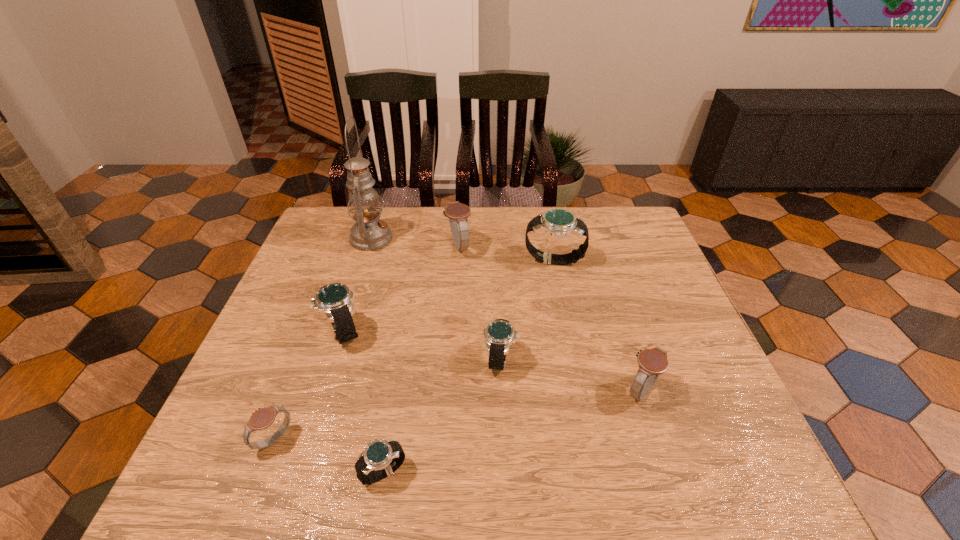
This screenshot has height=540, width=960. Identify the location of free spot at the left edge of the desktop. click(252, 433).

Identify the location of vacant space at the right edge. Image resolution: width=960 pixels, height=540 pixels. (604, 252).

The width and height of the screenshot is (960, 540). In order to click on free region at the far left corner of the desktop in this screenshot , I will do `click(336, 218)`.

In the image, there is a desktop. What are the coordinates of `vacant area at the near right corner` in the screenshot? It's located at (731, 480).

Identify the location of vacant space in between the rightmost gray watch and the fourth watch from right to left. The height and width of the screenshot is (540, 960). (550, 319).

At what (x,y) coordinates should I click in order to perform the action: click on free spot between the leftmost silver watch and the smallest silver watch. Please return your answer as a coordinate pair (x, y). This screenshot has height=540, width=960. Looking at the image, I should click on (364, 402).

Find the location of `vacant space that's between the second silver watch from right to left and the tallest object`. vacant space that's between the second silver watch from right to left and the tallest object is located at coordinates (436, 299).

Find the location of `vacant area that lies between the fifth watch from left to right and the rightmost silver watch`. vacant area that lies between the fifth watch from left to right and the rightmost silver watch is located at coordinates (527, 310).

You are a GUI agent. You are given a task and a screenshot of the screen. Output one action in this format:
    pyautogui.click(x=<x>, y=<y>)
    Task: Click on the free space that is in between the second smallest gray watch and the farthest silver watch
    
    Given the screenshot: What is the action you would take?
    pyautogui.click(x=598, y=326)

Where is `vacant region between the fifth watch from left to right and the second biggest gray watch`? This screenshot has width=960, height=540. vacant region between the fifth watch from left to right and the second biggest gray watch is located at coordinates (571, 375).